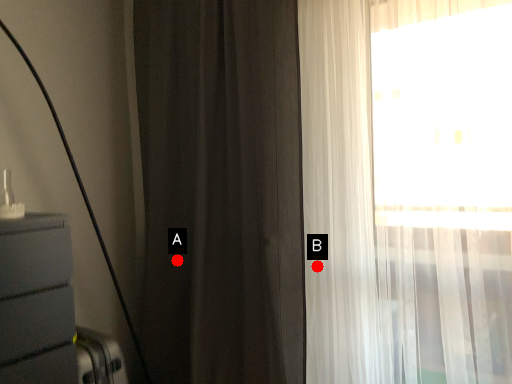
Question: Two points are circled on the image, labeled by A and B beside each circle. Which point is closer to the camera taking this photo?

Choices:
 (A) A is closer
 (B) B is closer

Answer: (B)